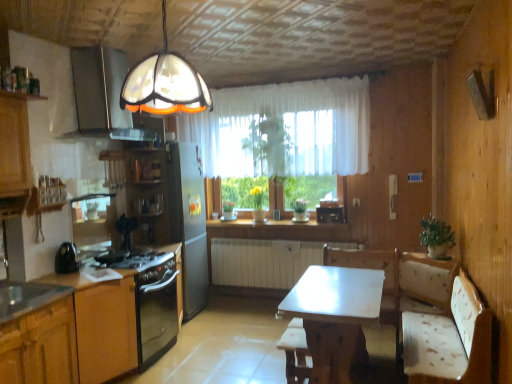
Question: From a real-world perspective, is white sheer curtain at center physically located above or below black glossy kettle at left?

Choices:
 (A) below
 (B) above

Answer: (B)

Question: From the image's perspective, is white sheer curtain at center positioned above or below black glossy kettle at left?

Choices:
 (A) above
 (B) below

Answer: (A)

Question: Which object is positioned closest to the wooden radio at center?

Choices:
 (A) wooden cabinet at left, arranged as the 2th cabinetry when viewed from the front
 (B) white glossy countertop at center
 (C) black matte gas stove at lower left
 (D) white sheer curtain at center
 (E) matte glass exhaust hood at upper left

Answer: (B)

Question: Considering the real-world distances, which object is farthest from the metallic stainless steel sink at lower left?

Choices:
 (A) black matte gas stove at lower left
 (B) matte glass exhaust hood at upper left
 (C) black glossy kettle at left
 (D) white glossy countertop at center
 (E) wooden bar stool at center

Answer: (D)